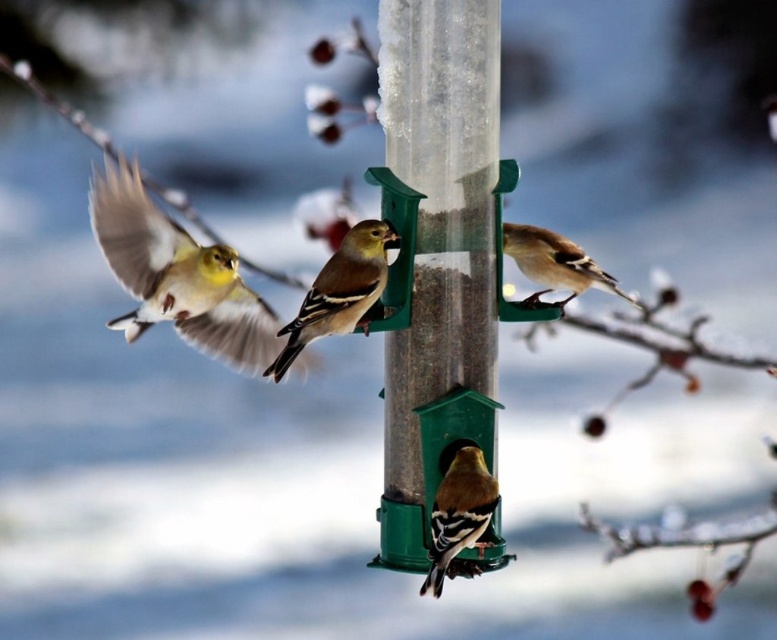
You are a bird trying to land on the transparent plastic pole at center. What are the coordinates you should aim for?

The transparent plastic pole at center is located at coordinates point (437, 252).